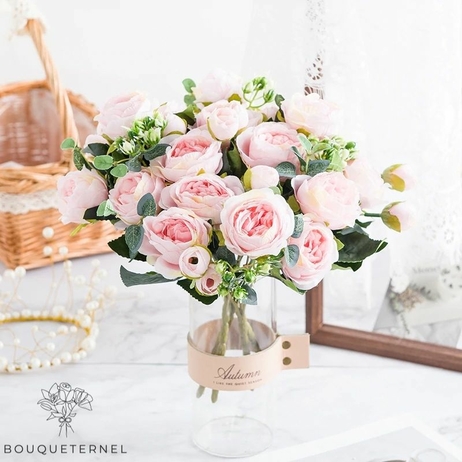
At what (x,y) coordinates should I click in order to perform the action: click on white wall. Please return your answer as a coordinate pair (x, y). This screenshot has width=462, height=462. Looking at the image, I should click on (9, 17), (15, 56), (431, 64), (243, 61), (429, 11), (243, 8).